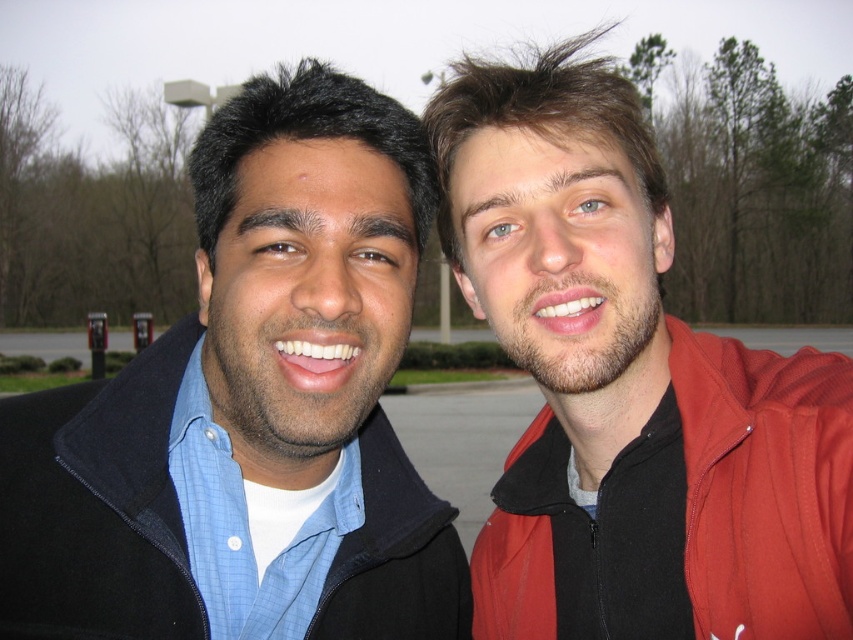
Does point (589, 376) come behind point (793, 577)?

Yes, point (589, 376) is farther from viewer.

Is red matte jacket at right bigger than red fleece jacket at right?

Indeed, red matte jacket at right has a larger size compared to red fleece jacket at right.

This screenshot has height=640, width=853. Identify the location of red matte jacket at right. (630, 388).

Which is behind, point (55, 522) or point (773, 618)?

Point (55, 522)

From the picture: Does matte black jacket at left have a greater width compared to red fleece jacket at right?

Yes.

Which is behind, point (407, 241) or point (828, 582)?

The point (407, 241) is more distant.

The image size is (853, 640). What are the coordinates of `matte black jacket at left` in the screenshot? It's located at (250, 408).

Can you confirm if matte black jacket at left is shorter than red matte jacket at right?

Yes, matte black jacket at left is shorter than red matte jacket at right.

Is point (51, 483) in front of point (839, 422)?

No, it is not.

Where is `matte black jacket at left`? matte black jacket at left is located at coordinates (250, 408).

I want to click on matte black jacket at left, so click(x=250, y=408).